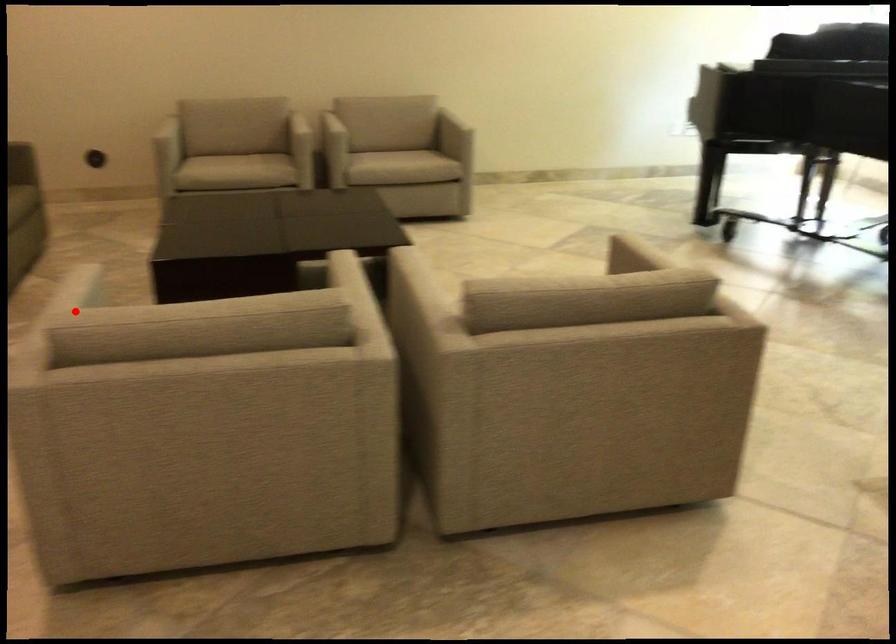
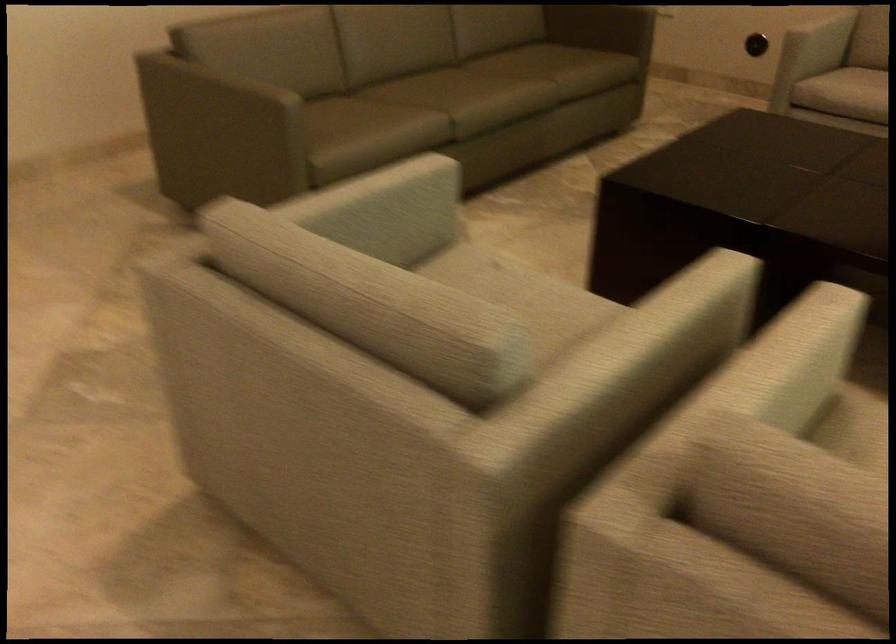
In the second image, find the point that corresponds to the highlighted location in the first image.

(380, 210)